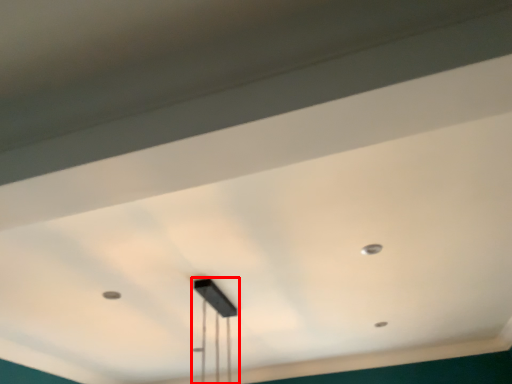
Question: From the image's perspective, where is lamp (annotated by the red box) located relative to dot?

Choices:
 (A) above
 (B) below

Answer: (B)